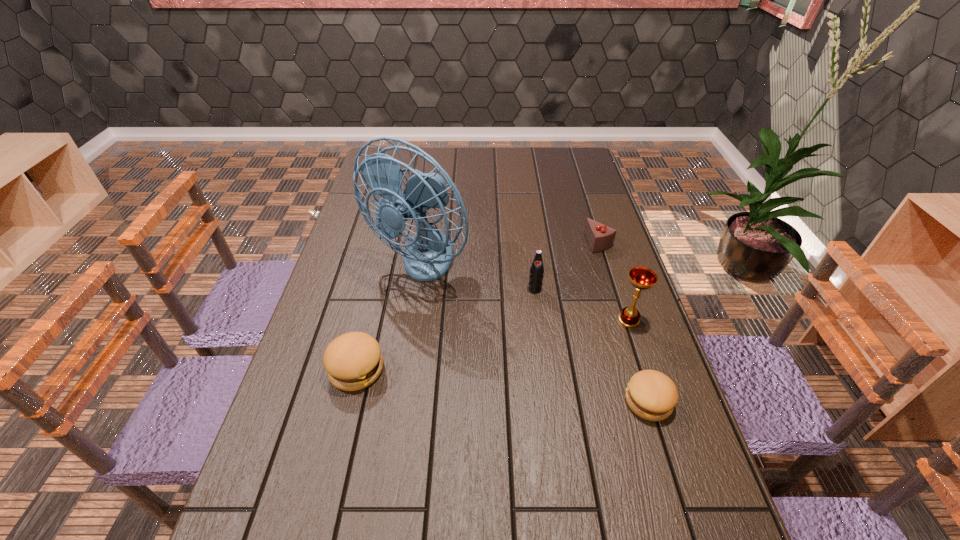
This screenshot has width=960, height=540. Identify the location of vacant space located 0.210m in front of the tallest object to blow air. (403, 361).

Identify the location of free point located 0.170m on the back of the chocolate cake. The image size is (960, 540). (587, 204).

At what (x,y) coordinates should I click in order to perform the action: click on free region located 0.060m on the front of the third nearest object. Please return your answer as a coordinate pair (x, y). Image resolution: width=960 pixels, height=540 pixels. Looking at the image, I should click on (637, 348).

Locate an element on the screen. This screenshot has height=540, width=960. hamburger that is positioned at the left edge is located at coordinates (353, 361).

Identify the location of fan that is at the left edge. The image size is (960, 540). (428, 255).

This screenshot has height=540, width=960. Identify the location of hamburger that is at the right edge. (650, 394).

Where is `chocolate cake located at the right edge`? The image size is (960, 540). chocolate cake located at the right edge is located at coordinates (600, 237).

Where is `chalice that is at the right edge`? The height and width of the screenshot is (540, 960). chalice that is at the right edge is located at coordinates (642, 278).

Locate an element on the screen. This screenshot has height=540, width=960. blank space at the far edge of the desktop is located at coordinates (530, 154).

Locate an element on the screen. vacant space at the left edge of the desktop is located at coordinates (334, 286).